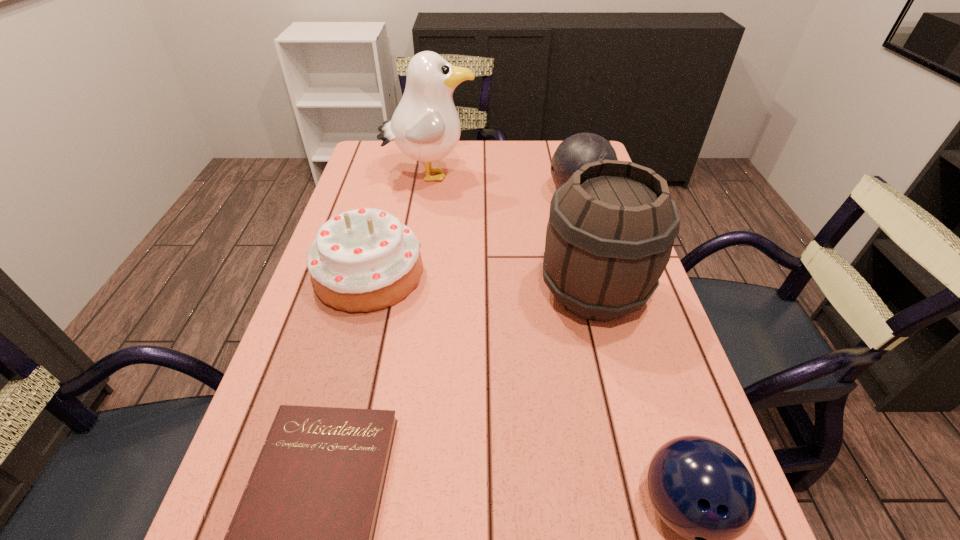
This screenshot has width=960, height=540. I want to click on free location at the right edge, so click(x=636, y=539).

Find the location of `vacant space at the far left corner of the desktop`. vacant space at the far left corner of the desktop is located at coordinates (383, 171).

Where is `vacant space that is in between the tallest object and the taller bowling ball`? The image size is (960, 540). vacant space that is in between the tallest object and the taller bowling ball is located at coordinates (504, 185).

This screenshot has height=540, width=960. In order to click on free area in between the cake and the taller bowling ball in this screenshot , I will do `click(474, 235)`.

Locate an element on the screen. Image resolution: width=960 pixels, height=540 pixels. object that is the fourth closest to the fifth tallest object is located at coordinates (577, 150).

Select which object appears as the third closest to the cake. Please provide its 2D coordinates. Your answer should be formatted as a tuple, i.e. [(x, y)], where the tuple contains the x and y coordinates of a point satisfying the conditions above.

[(611, 229)]

Find the location of a particular element. The height and width of the screenshot is (540, 960). free space that satisfies the following two spatial constraints: 1. on the grip area of the farther bowling ball; 2. on the front side of the second tallest object is located at coordinates (607, 293).

Where is `vacant space that satisfies the following two spatial constraints: 1. on the grip area of the farther bowling ball; 2. on the front side of the second tallest object`? vacant space that satisfies the following two spatial constraints: 1. on the grip area of the farther bowling ball; 2. on the front side of the second tallest object is located at coordinates (607, 293).

Identify the location of free point that satisfies the following two spatial constraints: 1. on the beak of the second tallest object; 2. on the left side of the tallest object. (412, 293).

Where is `vacant space that satisfies the following two spatial constraints: 1. on the back side of the wine bucket; 2. on the beak of the gull`? The width and height of the screenshot is (960, 540). vacant space that satisfies the following two spatial constraints: 1. on the back side of the wine bucket; 2. on the beak of the gull is located at coordinates (564, 176).